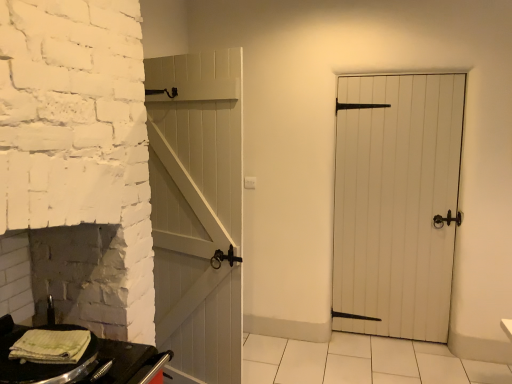
Question: Is black matte table at lower left surrounding white wooden door at center?

Choices:
 (A) yes
 (B) no

Answer: (B)

Question: From a real-world perspective, is black matte table at lower left located beneath white wooden door at center?

Choices:
 (A) no
 (B) yes

Answer: (B)

Question: Can you confirm if black matte table at lower left is smaller than white wooden door at center?

Choices:
 (A) no
 (B) yes

Answer: (B)

Question: From a real-world perspective, is black matte table at lower left located higher than white wooden door at center?

Choices:
 (A) yes
 (B) no

Answer: (B)

Question: Would you say black matte table at lower left is a long distance from white wooden door at center?

Choices:
 (A) no
 (B) yes

Answer: (B)

Question: In terms of height, does green striped towel at lower left look taller or shorter compared to black matte table at lower left?

Choices:
 (A) tall
 (B) short

Answer: (B)

Question: Does point (38, 340) appear closer or farther from the camera than point (144, 360)?

Choices:
 (A) closer
 (B) farther

Answer: (A)

Question: Looking at the image, does green striped towel at lower left seem bigger or smaller compared to black matte table at lower left?

Choices:
 (A) small
 (B) big

Answer: (A)

Question: From the image's perspective, is green striped towel at lower left above or below black matte table at lower left?

Choices:
 (A) below
 (B) above

Answer: (B)

Question: In terms of width, does black matte table at lower left look wider or thinner when compared to green striped towel at lower left?

Choices:
 (A) wide
 (B) thin

Answer: (A)

Question: From a real-world perspective, is black matte table at lower left above or below green striped towel at lower left?

Choices:
 (A) above
 (B) below

Answer: (B)

Question: From their relative heights in the image, would you say black matte table at lower left is taller or shorter than green striped towel at lower left?

Choices:
 (A) tall
 (B) short

Answer: (A)

Question: Is black matte table at lower left inside or outside of green striped towel at lower left?

Choices:
 (A) inside
 (B) outside

Answer: (B)

Question: Is white wooden door at center inside the boundaries of black matte table at lower left, or outside?

Choices:
 (A) inside
 (B) outside

Answer: (B)

Question: Based on their positions, is white wooden door at center located to the left or right of black matte table at lower left?

Choices:
 (A) left
 (B) right

Answer: (B)